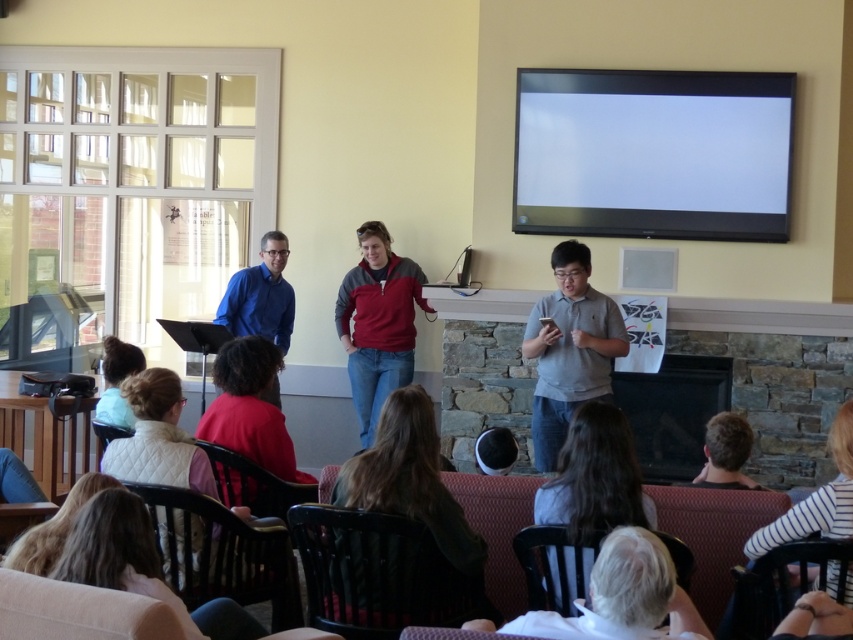
Question: Is light brown hair at lower center below red cotton shirt at center?

Choices:
 (A) no
 (B) yes

Answer: (B)

Question: Among these points, which one is farthest from the camera?

Choices:
 (A) (740, 451)
 (B) (265, 257)
 (C) (383, 266)

Answer: (C)

Question: Estimate the real-world distances between objects in this image. Which object is farther from the black glossy screen at upper center?

Choices:
 (A) gray cotton shirt at center
 (B) quilted beige vest at lower center
 (C) red cotton shirt at center
 (D) blue shirt at center

Answer: (B)

Question: In this image, where is black glossy screen at upper center located relative to quilted beige vest at lower center?

Choices:
 (A) left
 (B) right

Answer: (B)

Question: Which object is farther from the camera taking this photo?

Choices:
 (A) light brown hair at lower center
 (B) gray cotton shirt at center
 (C) blonde hair at lower left

Answer: (B)

Question: Is white fabric at lower center thinner than blue shirt at center?

Choices:
 (A) no
 (B) yes

Answer: (A)